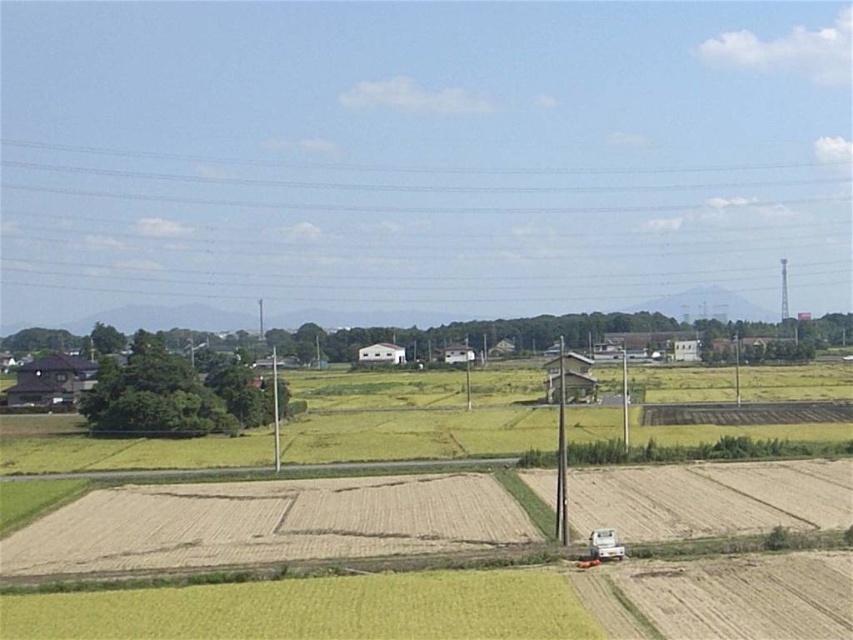
The width and height of the screenshot is (853, 640). Describe the element at coordinates (413, 417) in the screenshot. I see `green grass field at center` at that location.

Who is more forward, [814,374] or [228,605]?

Positioned in front is point [228,605].

Is point (741, 385) positioned before point (483, 572)?

No.

At what (x,y) coordinates should I click in order to perform the action: click on green grass field at center. Please return your answer as a coordinate pair (x, y). The height and width of the screenshot is (640, 853). Looking at the image, I should click on (413, 417).